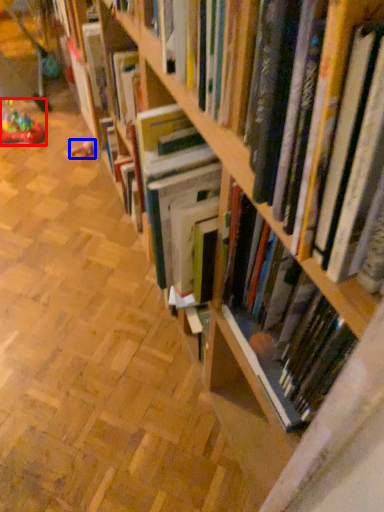
Question: Which object appears closest to the camera in this image, toy (highlighted by a red box) or toy (highlighted by a blue box)?

Choices:
 (A) toy
 (B) toy

Answer: (A)